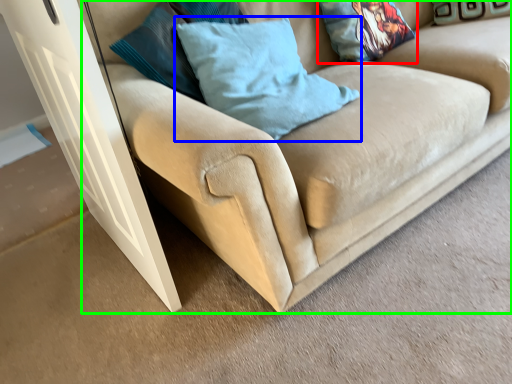
Question: Which object is the closest to the pillow (highlighted by a red box)? Choose among these: pillow (highlighted by a blue box) or studio couch (highlighted by a green box).

Choices:
 (A) pillow
 (B) studio couch

Answer: (B)